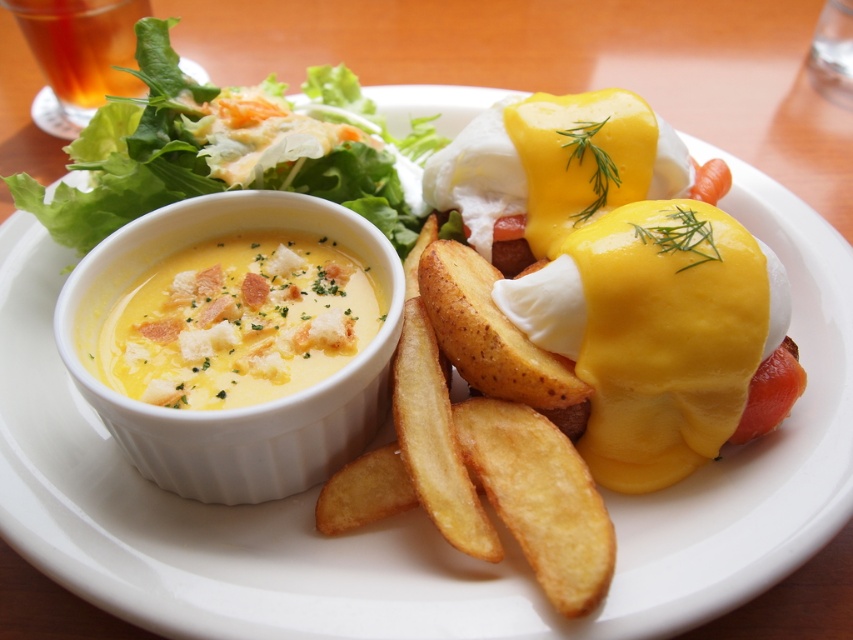
You are a food critic evaluating this breakfast plate. You notice two points on the plate at coordinates point (547, 568) and point (280, 269). Which of these points is closer to your perspective as you look at the plate?

Point (547, 568) is closer to the viewer than point (280, 269).